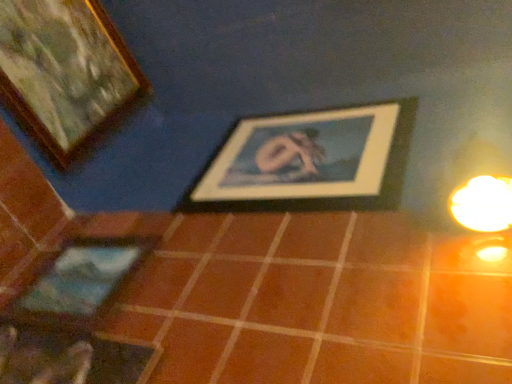
Question: Should I look upward or downward to see wooden picture frame at upper left, which is the first picture frame from top to bottom?

Choices:
 (A) down
 (B) up

Answer: (B)

Question: Can you confirm if matte blue picture frame at lower left, positioned as the 3th picture frame in top-to-bottom order, is thinner than brown matte tile at center?

Choices:
 (A) no
 (B) yes

Answer: (B)

Question: Is the depth of matte blue picture frame at lower left, which appears as the 1th picture frame when ordered from the bottom, greater than that of brown matte tile at center?

Choices:
 (A) no
 (B) yes

Answer: (B)

Question: Would you say matte blue picture frame at lower left, which appears as the 1th picture frame when ordered from the bottom, is outside brown matte tile at center?

Choices:
 (A) no
 (B) yes

Answer: (B)

Question: Is matte blue picture frame at lower left, which appears as the 1th picture frame when ordered from the bottom, in front of brown matte tile at center?

Choices:
 (A) no
 (B) yes

Answer: (A)

Question: Is matte blue picture frame at lower left, which appears as the 1th picture frame when ordered from the bottom, next to brown matte tile at center?

Choices:
 (A) no
 (B) yes

Answer: (A)

Question: From a real-world perspective, is matte blue picture frame at lower left, positioned as the 2th picture frame in left-to-right order, beneath brown matte tile at center?

Choices:
 (A) yes
 (B) no

Answer: (A)

Question: Can you confirm if brown matte tile at center is shorter than wooden framed picture at center, which appears as the 1th picture frame when viewed from the right?

Choices:
 (A) yes
 (B) no

Answer: (A)

Question: Does brown matte tile at center have a greater width compared to wooden framed picture at center, the 2th picture frame positioned from the bottom?

Choices:
 (A) no
 (B) yes

Answer: (A)

Question: From a real-world perspective, is brown matte tile at center positioned under wooden framed picture at center, which is the third picture frame from left to right, based on gravity?

Choices:
 (A) yes
 (B) no

Answer: (A)

Question: Considering the relative sizes of brown matte tile at center and wooden framed picture at center, which appears as the 1th picture frame when viewed from the right, in the image provided, is brown matte tile at center taller than wooden framed picture at center, which appears as the 1th picture frame when viewed from the right,?

Choices:
 (A) yes
 (B) no

Answer: (B)

Question: Is the surface of brown matte tile at center in direct contact with wooden framed picture at center, the 2th picture frame positioned from the bottom?

Choices:
 (A) no
 (B) yes

Answer: (A)

Question: Does brown matte tile at center turn towards wooden framed picture at center, the 2th picture frame positioned from the bottom?

Choices:
 (A) yes
 (B) no

Answer: (B)

Question: Can you confirm if wooden framed picture at center, the 2th picture frame positioned from the top, is smaller than wooden picture frame at upper left, which ranks as the first picture frame in left-to-right order?

Choices:
 (A) yes
 (B) no

Answer: (A)